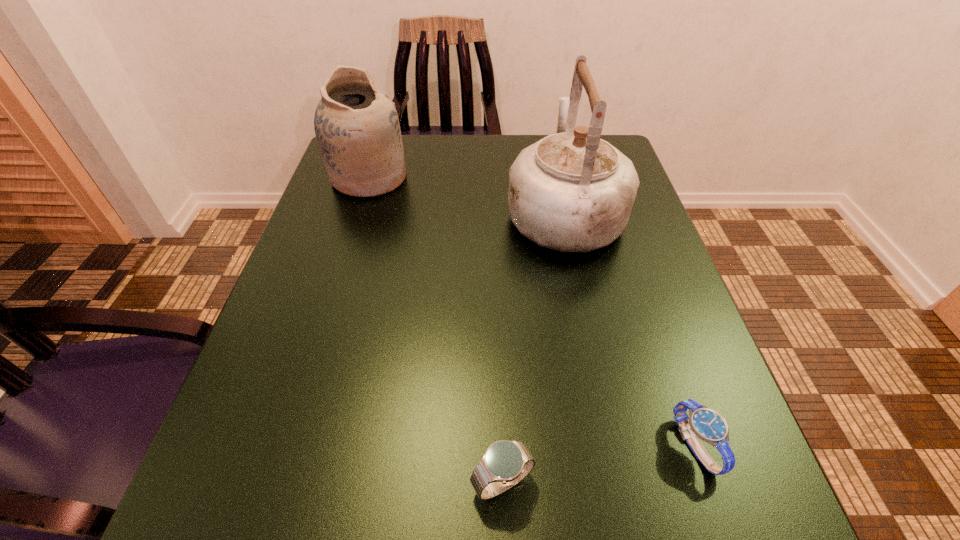
What are the coordinates of `the tallest object` in the screenshot? It's located at (571, 191).

This screenshot has height=540, width=960. Identify the location of pottery. (357, 128).

At what (x,y) coordinates should I click in order to perform the action: click on the second tallest object. Please return your answer as a coordinate pair (x, y). The height and width of the screenshot is (540, 960). Looking at the image, I should click on (357, 128).

Locate an element on the screen. The height and width of the screenshot is (540, 960). the left watch is located at coordinates (505, 463).

Locate an element on the screen. This screenshot has width=960, height=540. the second shortest object is located at coordinates (505, 463).

At what (x,y) coordinates should I click in order to perform the action: click on the right watch. Please return your answer as a coordinate pair (x, y). This screenshot has width=960, height=540. Looking at the image, I should click on (708, 425).

At what (x,y) coordinates should I click in order to perform the action: click on the shortest object. Please return your answer as a coordinate pair (x, y). Looking at the image, I should click on (708, 425).

This screenshot has height=540, width=960. I want to click on vacant space located at the spout of the kettle, so [552, 155].

Identify the location of vacant space located at the spout of the kettle. This screenshot has width=960, height=540. (553, 161).

I want to click on free space located at the spout of the kettle, so click(x=553, y=161).